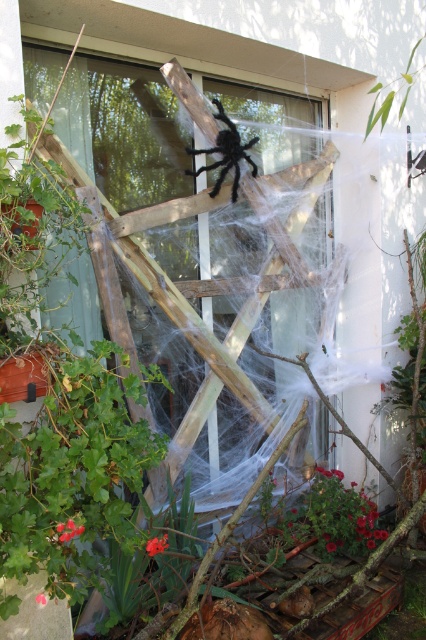
Question: Is green matte plant at lower right further to camera compared to black fuzzy spider at upper center?

Choices:
 (A) no
 (B) yes

Answer: (B)

Question: Which object is closer to the camera taking this photo?

Choices:
 (A) green matte plant at lower right
 (B) black fuzzy spider at upper center

Answer: (B)

Question: Does green matte plant at lower right appear on the right side of black fuzzy spider at upper center?

Choices:
 (A) yes
 (B) no

Answer: (A)

Question: Does green matte plant at lower right come behind black fuzzy spider at upper center?

Choices:
 (A) yes
 (B) no

Answer: (A)